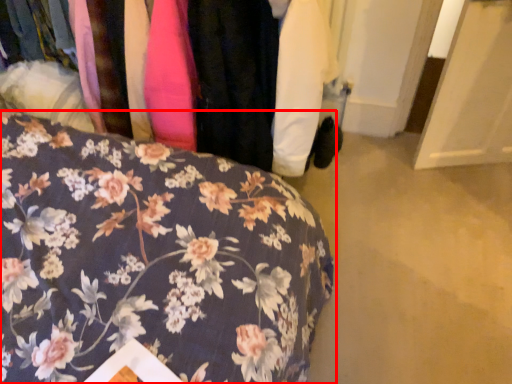
Question: From the image's perspective, considering the relative positions of furniture (annotated by the red box) and closet in the image provided, where is furniture (annotated by the red box) located with respect to the staircase?

Choices:
 (A) above
 (B) below

Answer: (B)